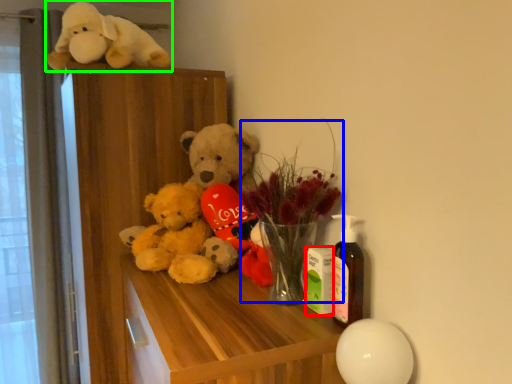
Question: Based on their relative distances, which object is farther from toy (highlighted by a red box)? Choose from floral arrangement (highlighted by a blue box) and toy (highlighted by a green box).

Choices:
 (A) floral arrangement
 (B) toy

Answer: (B)